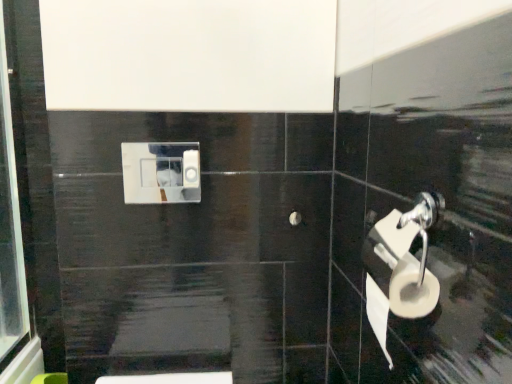
Question: Is white matte toilet paper at right, the 1th toilet paper ordered from the bottom, shorter than white plastic toilet paper at center, which is the second toilet paper from right to left?

Choices:
 (A) no
 (B) yes

Answer: (A)

Question: Is white matte toilet paper at right, which is the second toilet paper in top-to-bottom order, positioned before white plastic toilet paper at center, which is counted as the first toilet paper, starting from the top?

Choices:
 (A) yes
 (B) no

Answer: (A)

Question: Can you confirm if white matte toilet paper at right, which is counted as the second toilet paper, starting from the left, is wider than white plastic toilet paper at center, which is counted as the first toilet paper, starting from the top?

Choices:
 (A) yes
 (B) no

Answer: (A)

Question: Is white matte toilet paper at right, which is counted as the second toilet paper, starting from the left, in contact with white plastic toilet paper at center, which is the second toilet paper from right to left?

Choices:
 (A) no
 (B) yes

Answer: (A)

Question: Can you confirm if white matte toilet paper at right, the 1th toilet paper ordered from the bottom, is bigger than white plastic toilet paper at center, which is counted as the 1th toilet paper, starting from the left?

Choices:
 (A) no
 (B) yes

Answer: (B)

Question: From a real-world perspective, is white matte toilet paper at right, the 1th toilet paper viewed from the right, positioned over white plastic toilet paper at center, which is counted as the first toilet paper, starting from the top, based on gravity?

Choices:
 (A) no
 (B) yes

Answer: (A)

Question: Is white plastic toilet paper at center, which is the second toilet paper in front-to-back order, shorter than white matte toilet paper at right, the 1th toilet paper viewed from the right?

Choices:
 (A) no
 (B) yes

Answer: (B)

Question: Does white plastic toilet paper at center, which ranks as the 2th toilet paper in bottom-to-top order, have a greater width compared to white matte toilet paper at right, the 1th toilet paper ordered from the bottom?

Choices:
 (A) yes
 (B) no

Answer: (B)

Question: From the image's perspective, is white plastic toilet paper at center, which is the second toilet paper from right to left, beneath white matte toilet paper at right, which is counted as the 2th toilet paper, starting from the back?

Choices:
 (A) no
 (B) yes

Answer: (A)

Question: Does white plastic toilet paper at center, which ranks as the 2th toilet paper in bottom-to-top order, have a larger size compared to white matte toilet paper at right, which is the 1th toilet paper from front to back?

Choices:
 (A) no
 (B) yes

Answer: (A)

Question: Is white plastic toilet paper at center, which is counted as the first toilet paper, starting from the top, aimed at white matte toilet paper at right, the 1th toilet paper viewed from the right?

Choices:
 (A) yes
 (B) no

Answer: (B)

Question: Are white plastic toilet paper at center, positioned as the 1th toilet paper in back-to-front order, and white matte toilet paper at right, which is counted as the 2th toilet paper, starting from the back, making contact?

Choices:
 (A) yes
 (B) no

Answer: (B)

Question: From a real-world perspective, is white matte toilet paper at right, which is the second toilet paper in top-to-bottom order, above or below white plastic toilet paper at center, which ranks as the 2th toilet paper in bottom-to-top order?

Choices:
 (A) above
 (B) below

Answer: (B)